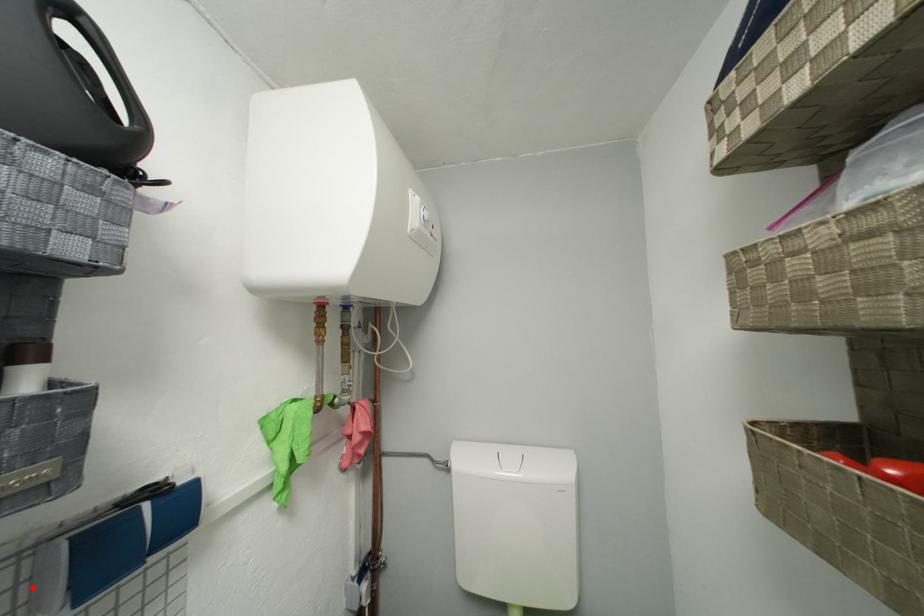
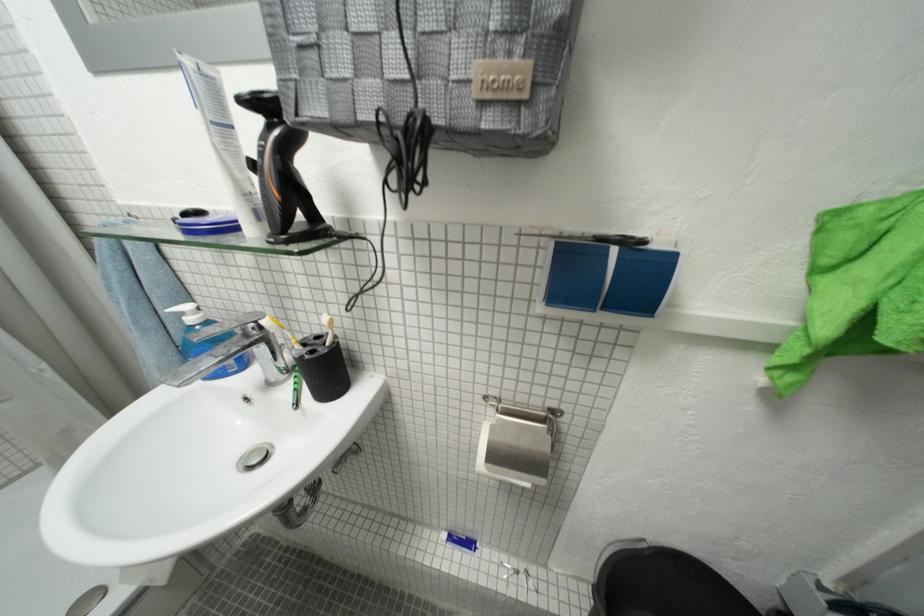
In the second image, find the point that corresponds to the highlighted location in the first image.

(546, 273)